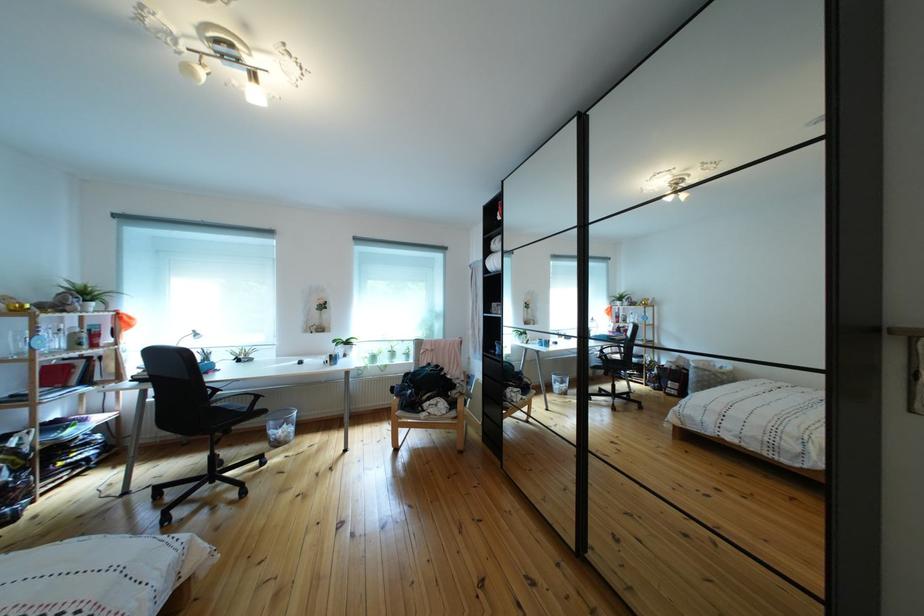
The location [281,426] corresponds to which object?

It corresponds to the wire mesh trashcan in the image.